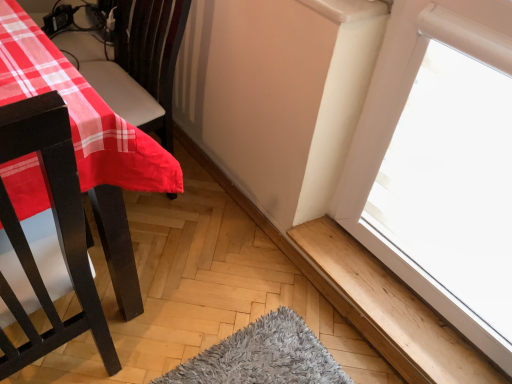
You are a GUI agent. You are given a task and a screenshot of the screen. Output one action in this format:
    pyautogui.click(x=<x>, y=<y>)
    Task: Click on the matte plastic table at left
    The image size is (512, 384).
    Given the screenshot: What is the action you would take?
    pyautogui.click(x=80, y=111)

The image size is (512, 384). Describe the element at coordinates (80, 111) in the screenshot. I see `matte plastic table at left` at that location.

Describe the element at coordinates (388, 310) in the screenshot. I see `wooden at lower right` at that location.

Locate an element on the screen. wooden at lower right is located at coordinates (388, 310).

The height and width of the screenshot is (384, 512). What are the coordinates of `matte plastic table at left` in the screenshot? It's located at (80, 111).

Which is more to the left, wooden at lower right or matte plastic table at left?

matte plastic table at left is more to the left.

Which object is further away from the camera, wooden at lower right or matte plastic table at left?

wooden at lower right is further from the camera.

Which is farther, (340,241) or (9,48)?

The point (340,241) is farther from the camera.

From the image's perspective, which one is positioned higher, wooden at lower right or matte plastic table at left?

matte plastic table at left, from the image's perspective.

From a real-world perspective, between wooden at lower right and matte plastic table at left, who is vertically higher?

matte plastic table at left is physically above.

Looking at this image, which object is wider, wooden at lower right or matte plastic table at left?

matte plastic table at left.

Considering the sizes of objects wooden at lower right and matte plastic table at left in the image provided, who is shorter, wooden at lower right or matte plastic table at left?

wooden at lower right.

Between wooden at lower right and matte plastic table at left, which one has larger size?

With larger size is matte plastic table at left.

Is matte plastic table at left surrounded by wooden at lower right?

No, matte plastic table at left is not inside wooden at lower right.

Can you see wooden at lower right touching matte plastic table at left?

No, wooden at lower right is not next to matte plastic table at left.

Is wooden at lower right facing away from matte plastic table at left?

No.

How many degrees apart are the facing directions of wooden at lower right and matte plastic table at left?

The angular difference between wooden at lower right and matte plastic table at left is 3.28 degrees.

Measure the distance between wooden at lower right and matte plastic table at left.

They are 32.91 inches apart.

Identify the location of window sill that appears below the matte plastic table at left (from the image's perspective). This screenshot has width=512, height=384. (388, 310).

Is matte plastic table at left at the left side of wooden at lower right?

Yes.

Considering the positions of objects matte plastic table at left and wooden at lower right in the image provided, who is behind, matte plastic table at left or wooden at lower right?

wooden at lower right.

Does point (23, 19) lie behind point (317, 266)?

That is False.

From the image's perspective, does matte plastic table at left appear lower than wooden at lower right?

No, from the image's perspective, matte plastic table at left is not below wooden at lower right.

From a real-world perspective, is matte plastic table at left located higher than wooden at lower right?

Yes, from a real-world perspective, matte plastic table at left is on top of wooden at lower right.

From the picture: Is matte plastic table at left thinner than wooden at lower right?

No, matte plastic table at left is not thinner than wooden at lower right.

Who is shorter, matte plastic table at left or wooden at lower right?

Standing shorter between the two is wooden at lower right.

Can you confirm if matte plastic table at left is bigger than wooden at lower right?

Indeed, matte plastic table at left has a larger size compared to wooden at lower right.

Is matte plastic table at left outside of wooden at lower right?

Yes, matte plastic table at left is located beyond the bounds of wooden at lower right.

In the scene shown: Is there a large distance between matte plastic table at left and wooden at lower right?

matte plastic table at left is actually quite close to wooden at lower right.

Is matte plastic table at left turned away from wooden at lower right?

matte plastic table at left does not have its back to wooden at lower right.

Where is `table in front of the wooden at lower right`? This screenshot has height=384, width=512. table in front of the wooden at lower right is located at coordinates (80, 111).

This screenshot has height=384, width=512. What are the coordinates of `table to the left of wooden at lower right` in the screenshot? It's located at 80,111.

Identify the location of table in front of the wooden at lower right. The height and width of the screenshot is (384, 512). (80, 111).